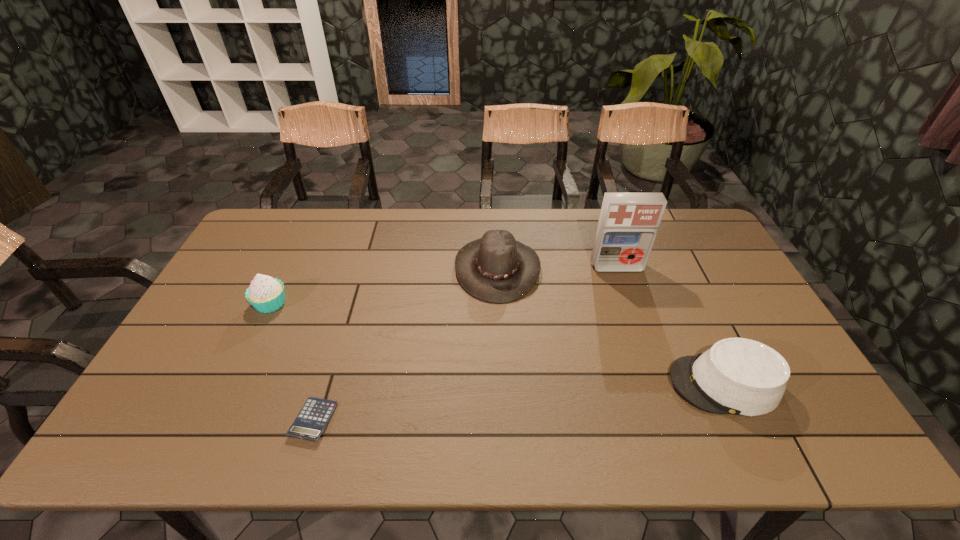
Locate an element on the screen. The height and width of the screenshot is (540, 960). free space between the leftmost object and the tallest object is located at coordinates (444, 286).

Where is `vacant area that lies between the first-aid kit and the left hat`? vacant area that lies between the first-aid kit and the left hat is located at coordinates (557, 268).

Where is `free point between the cupcake and the second object from left to right`? free point between the cupcake and the second object from left to right is located at coordinates (292, 362).

Image resolution: width=960 pixels, height=540 pixels. In order to click on free space that is in between the fourth object from right to left and the nearer hat in this screenshot , I will do tap(518, 402).

Where is `unoccupied position between the first-aid kit and the fourth object from right to left`? This screenshot has height=540, width=960. unoccupied position between the first-aid kit and the fourth object from right to left is located at coordinates (466, 344).

Identify which object is the third closest to the shortest object. Please provide its 2D coordinates. Your answer should be formatted as a tuple, i.e. [(x, y)], where the tuple contains the x and y coordinates of a point satisfying the conditions above.

[(738, 376)]

Point out which object is positioned as the third nearest to the calculator. Please provide its 2D coordinates. Your answer should be formatted as a tuple, i.e. [(x, y)], where the tuple contains the x and y coordinates of a point satisfying the conditions above.

[(738, 376)]

Find the location of `vacant space that satisfies the following two spatial constraints: 1. on the front-facing side of the third object from right to left; 2. on the front side of the shortest object`. vacant space that satisfies the following two spatial constraints: 1. on the front-facing side of the third object from right to left; 2. on the front side of the shortest object is located at coordinates click(504, 420).

The width and height of the screenshot is (960, 540). Identify the location of vacant space that satisfies the following two spatial constraints: 1. on the front-facing side of the farther hat; 2. on the front side of the shortest object. (504, 420).

This screenshot has width=960, height=540. In order to click on vacant position in the image that satisfies the following two spatial constraints: 1. on the front side of the calculator; 2. on the right side of the cupcake in this screenshot , I will do `click(215, 420)`.